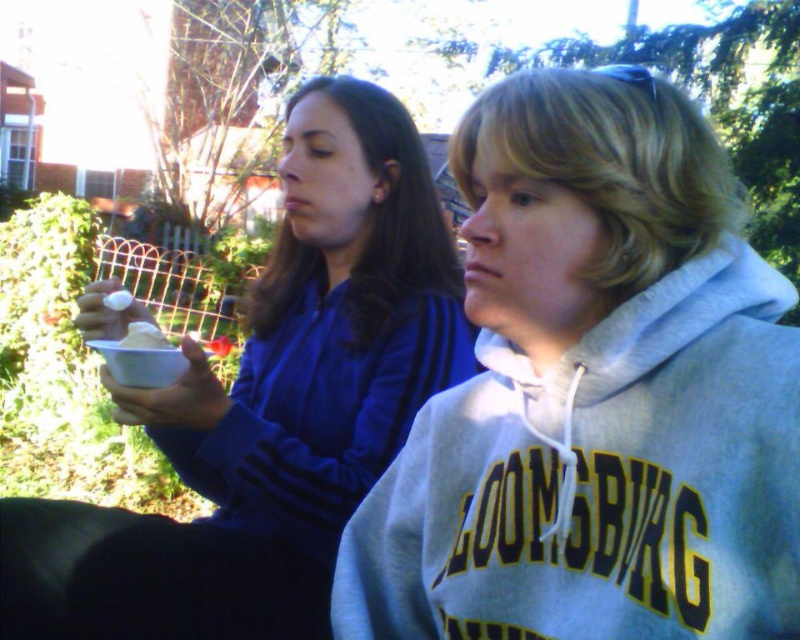
Question: Does matte blue sweatshirt at center have a larger size compared to white matte cup at center?

Choices:
 (A) no
 (B) yes

Answer: (B)

Question: Does gray fleece sweatshirt at center have a smaller size compared to matte blue sweatshirt at center?

Choices:
 (A) no
 (B) yes

Answer: (B)

Question: Which point is closer to the camera taking this photo?

Choices:
 (A) (146, 323)
 (B) (528, 365)
 (C) (322, 310)

Answer: (B)

Question: Does gray fleece sweatshirt at center come in front of white matte cup at center?

Choices:
 (A) no
 (B) yes

Answer: (B)

Question: Which point is closer to the camera?

Choices:
 (A) (652, 320)
 (B) (130, 337)
 (C) (158, 403)

Answer: (A)

Question: Estimate the real-world distances between objects in this image. Which object is closer to the gray fleece sweatshirt at center?

Choices:
 (A) matte blue sweatshirt at center
 (B) white matte cup at center

Answer: (A)